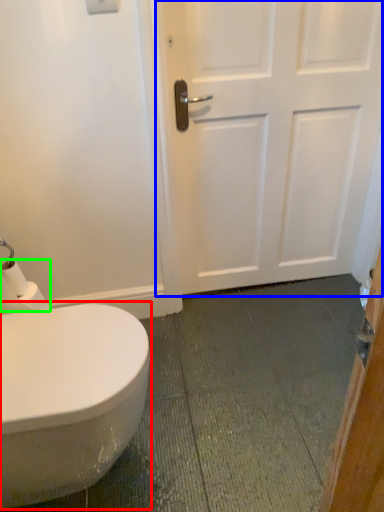
Question: Estimate the real-world distances between objects in this image. Which object is farther from bidet (highlighted by a red box), door (highlighted by a blue box) or toilet paper (highlighted by a green box)?

Choices:
 (A) door
 (B) toilet paper

Answer: (A)